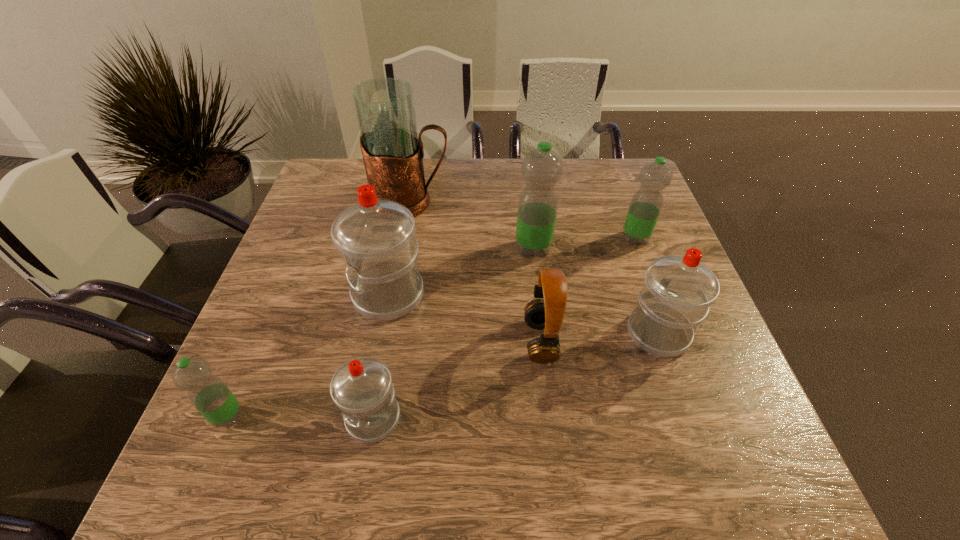
Locate an element on the screen. The height and width of the screenshot is (540, 960). vacant space at the right edge is located at coordinates (706, 430).

You are a GUI agent. You are given a task and a screenshot of the screen. Output one action in this format:
    pyautogui.click(x=<x>, y=<y>)
    Task: Click on the free space at the far left corner
    The width and height of the screenshot is (960, 540).
    Given the screenshot: What is the action you would take?
    pyautogui.click(x=343, y=158)

In the image, there is a desktop. Where is `vacant space at the far right corner`? vacant space at the far right corner is located at coordinates (598, 189).

In the image, there is a desktop. Where is `blank space at the near right corner`? Image resolution: width=960 pixels, height=540 pixels. blank space at the near right corner is located at coordinates (756, 491).

Locate an element on the screen. The image size is (960, 540). free space between the rightmost green water bottle and the brown headset is located at coordinates (588, 289).

Locate an element on the screen. The width and height of the screenshot is (960, 540). empty location between the biggest white water bottle and the third water bottle from right to left is located at coordinates (461, 272).

Locate an element on the screen. Image resolution: width=960 pixels, height=540 pixels. free space that is in between the headset and the farthest object is located at coordinates (475, 272).

You are a GUI agent. You are given a task and a screenshot of the screen. Output one action in this format:
    pyautogui.click(x=<x>, y=<y>)
    Task: Click on the free space between the second biggest white water bottle and the farthest object
    This screenshot has width=960, height=540.
    Given the screenshot: What is the action you would take?
    pyautogui.click(x=534, y=267)

At what (x,y) coordinates should I click in order to perform the action: click on free space between the leftmost green water bottle and the rightmost green water bottle. Please return your answer as a coordinate pair (x, y). Looking at the image, I should click on (432, 327).

Identify the location of unoccupied position between the headset and the biggest white water bottle. (465, 318).